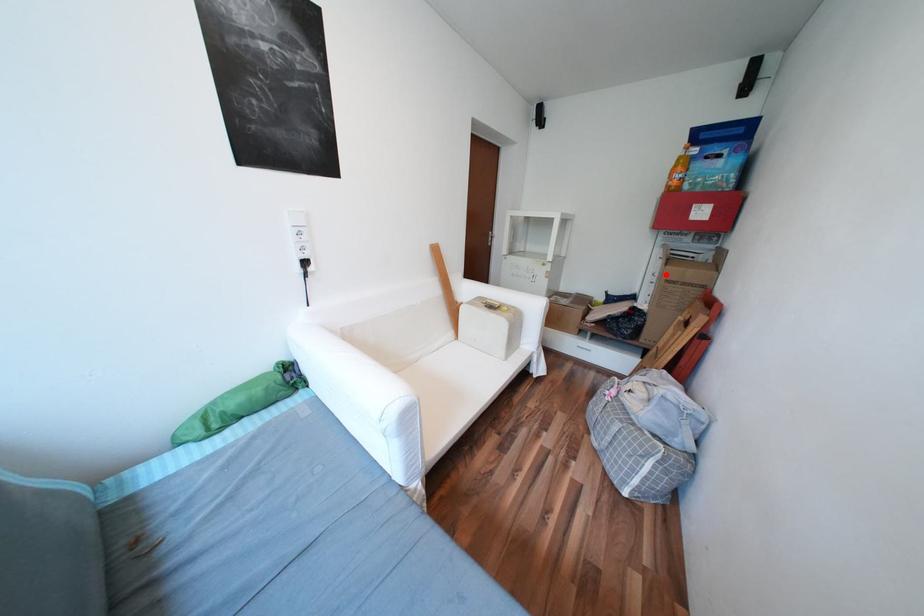
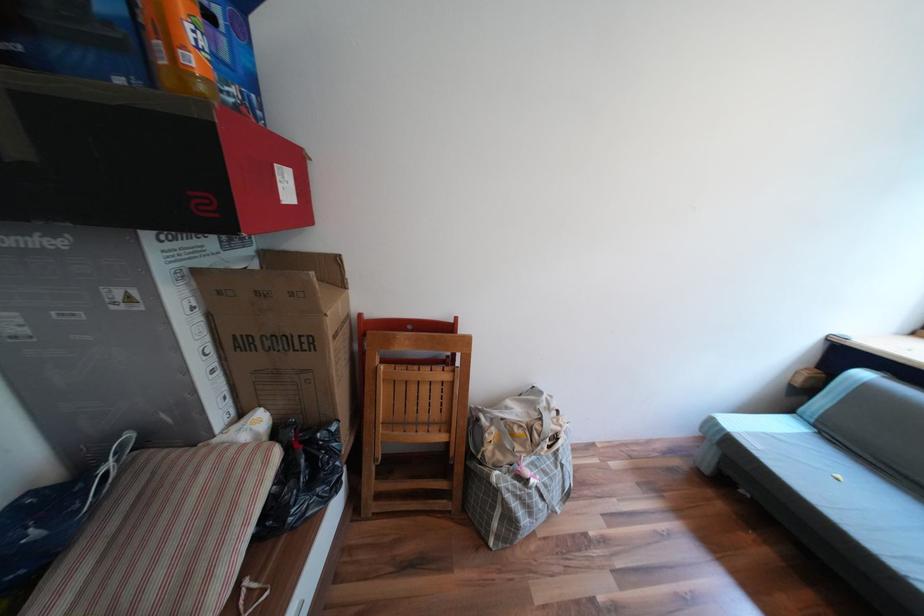
The point at the highlighted location is marked in the first image. Where is the corresponding point in the second image?

(219, 349)